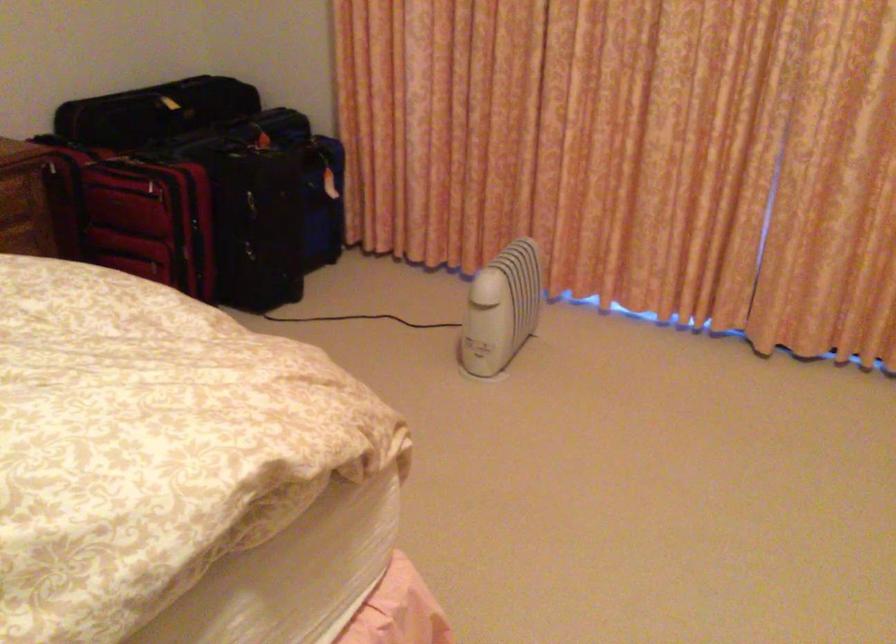
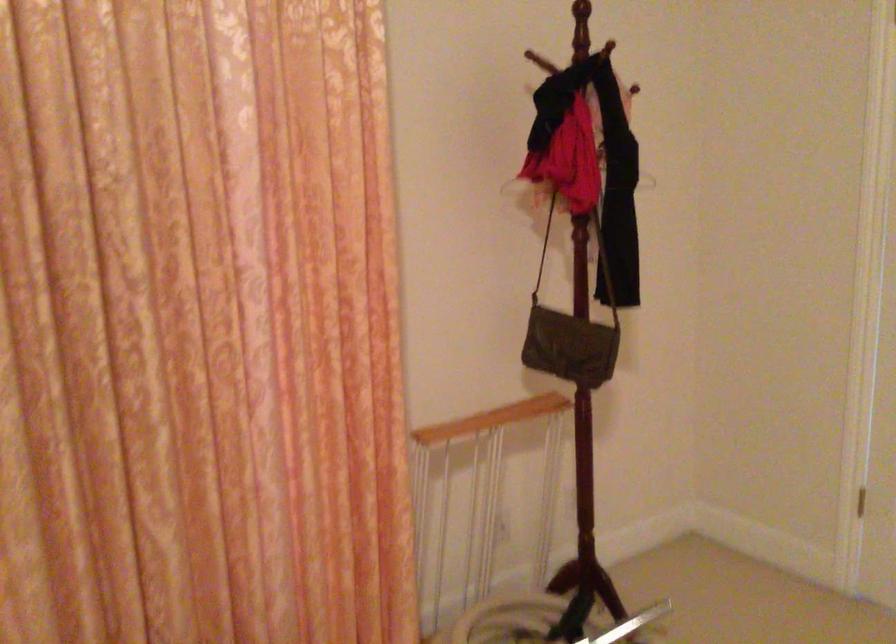
Question: The camera is either moving clockwise (left) or counter-clockwise (right) around the object. The first image is from the beginning of the video and the second image is from the end. Is the camera moving left or right when shooting the video?

Choices:
 (A) Left
 (B) Right

Answer: (A)